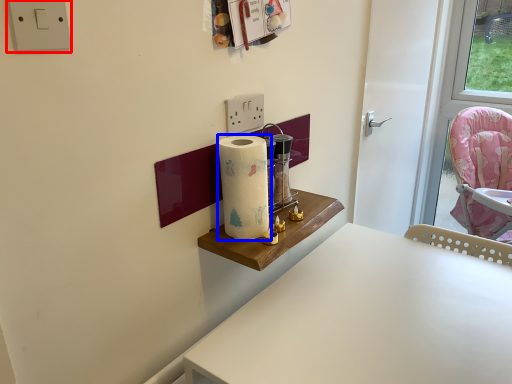
Question: Which object is closer to the camera taking this photo, electric outlet (highlighted by a red box) or paper towel (highlighted by a blue box)?

Choices:
 (A) electric outlet
 (B) paper towel

Answer: (A)